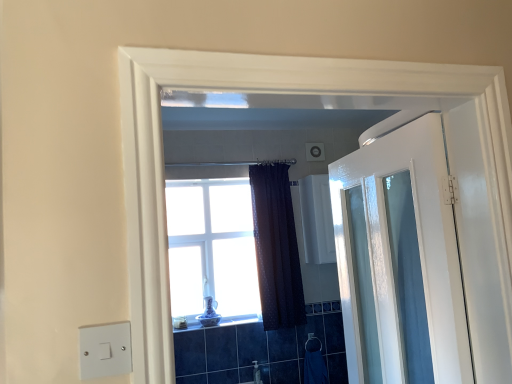
Question: Should I look upward or downward to see white glossy medicine cabinet at upper center?

Choices:
 (A) down
 (B) up

Answer: (A)

Question: Can you confirm if white plastic light switch at lower left is shorter than white glossy medicine cabinet at upper center?

Choices:
 (A) yes
 (B) no

Answer: (A)

Question: Does white plastic light switch at lower left have a larger size compared to white glossy medicine cabinet at upper center?

Choices:
 (A) yes
 (B) no

Answer: (B)

Question: Is white plastic light switch at lower left further to the viewer compared to white glossy medicine cabinet at upper center?

Choices:
 (A) yes
 (B) no

Answer: (B)

Question: Is white plastic light switch at lower left oriented towards white glossy medicine cabinet at upper center?

Choices:
 (A) yes
 (B) no

Answer: (B)

Question: Is white plastic light switch at lower left not close to white glossy medicine cabinet at upper center?

Choices:
 (A) no
 (B) yes

Answer: (B)

Question: Can you confirm if white plastic light switch at lower left is positioned to the left of white glossy medicine cabinet at upper center?

Choices:
 (A) no
 (B) yes

Answer: (B)

Question: From a real-world perspective, is white glossy medicine cabinet at upper center beneath white plastic light switch at lower left?

Choices:
 (A) yes
 (B) no

Answer: (B)

Question: From a real-world perspective, does white glossy medicine cabinet at upper center stand above white plastic light switch at lower left?

Choices:
 (A) no
 (B) yes

Answer: (B)

Question: Could you tell me if white glossy medicine cabinet at upper center is facing white plastic light switch at lower left?

Choices:
 (A) yes
 (B) no

Answer: (B)

Question: Can you confirm if white glossy medicine cabinet at upper center is shorter than white plastic light switch at lower left?

Choices:
 (A) no
 (B) yes

Answer: (A)

Question: From the image's perspective, is white glossy medicine cabinet at upper center below white plastic light switch at lower left?

Choices:
 (A) yes
 (B) no

Answer: (B)

Question: Does white glossy medicine cabinet at upper center come in front of white plastic light switch at lower left?

Choices:
 (A) no
 (B) yes

Answer: (A)

Question: Is clear glass window at center inside white glossy door at right?

Choices:
 (A) yes
 (B) no

Answer: (B)